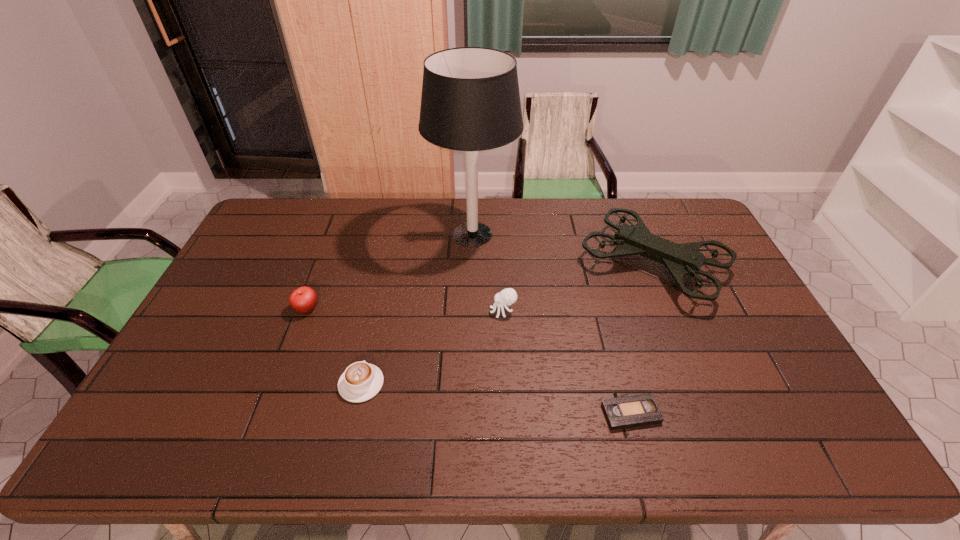
Identify which object is located as the nearest to the apple. Please provide its 2D coordinates. Your answer should be formatted as a tuple, i.e. [(x, y)], where the tuple contains the x and y coordinates of a point satisfying the conditions above.

[(361, 381)]

Where is `vacant space that satisfies the following two spatial constraints: 1. on the back side of the drone; 2. on the right side of the videotape`? Image resolution: width=960 pixels, height=540 pixels. vacant space that satisfies the following two spatial constraints: 1. on the back side of the drone; 2. on the right side of the videotape is located at coordinates click(x=591, y=265).

This screenshot has width=960, height=540. What are the coordinates of `vacant point that satisfies the following two spatial constraints: 1. on the front-facing side of the videotape; 2. on the left side of the octopus` in the screenshot? It's located at (508, 413).

This screenshot has height=540, width=960. In order to click on free space in the image that satisfies the following two spatial constraints: 1. on the front-facing side of the octopus; 2. on the left side of the shortest object in this screenshot , I will do `click(508, 413)`.